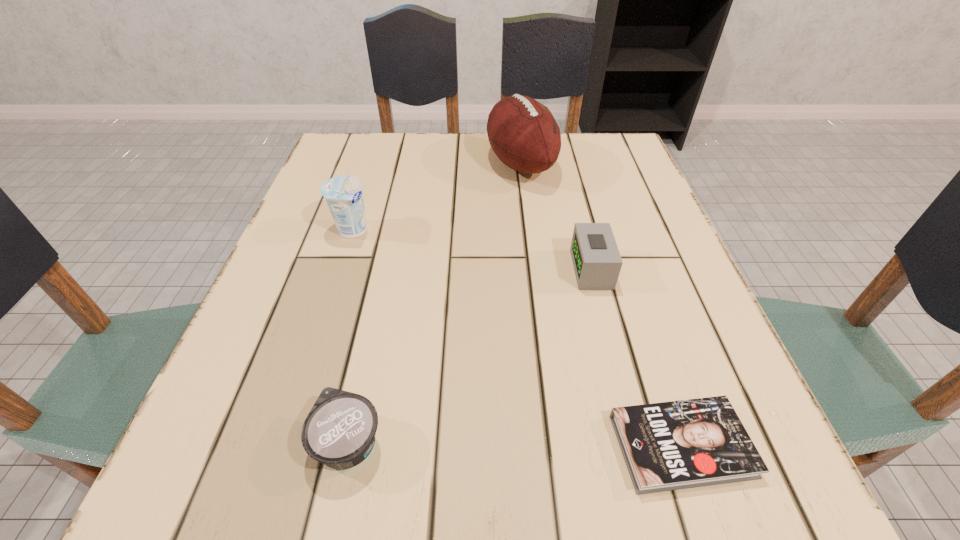
This screenshot has height=540, width=960. In order to click on the farthest object in this screenshot , I will do `click(522, 132)`.

At what (x,y) coordinates should I click in order to perform the action: click on the tallest object. Please return your answer as a coordinate pair (x, y). Looking at the image, I should click on (522, 132).

Find the location of `the farther yogurt`. the farther yogurt is located at coordinates (344, 194).

Image resolution: width=960 pixels, height=540 pixels. I want to click on the second tallest object, so click(344, 194).

The width and height of the screenshot is (960, 540). Identify the location of the third shortest object. (596, 259).

At what (x,y) coordinates should I click in order to perform the action: click on alarm clock. Please return your answer as a coordinate pair (x, y). Looking at the image, I should click on tap(596, 259).

Locate an element on the screen. This screenshot has width=960, height=540. the nearer yogurt is located at coordinates (340, 430).

Locate an element on the screen. Image resolution: width=960 pixels, height=540 pixels. the fourth tallest object is located at coordinates (340, 430).

At what (x,y) coordinates should I click in order to perform the action: click on book. Please return your answer as a coordinate pair (x, y). This screenshot has height=540, width=960. Looking at the image, I should click on (674, 445).

The image size is (960, 540). I want to click on vacant area situated 0.310m on the left of the football (American), so click(360, 164).